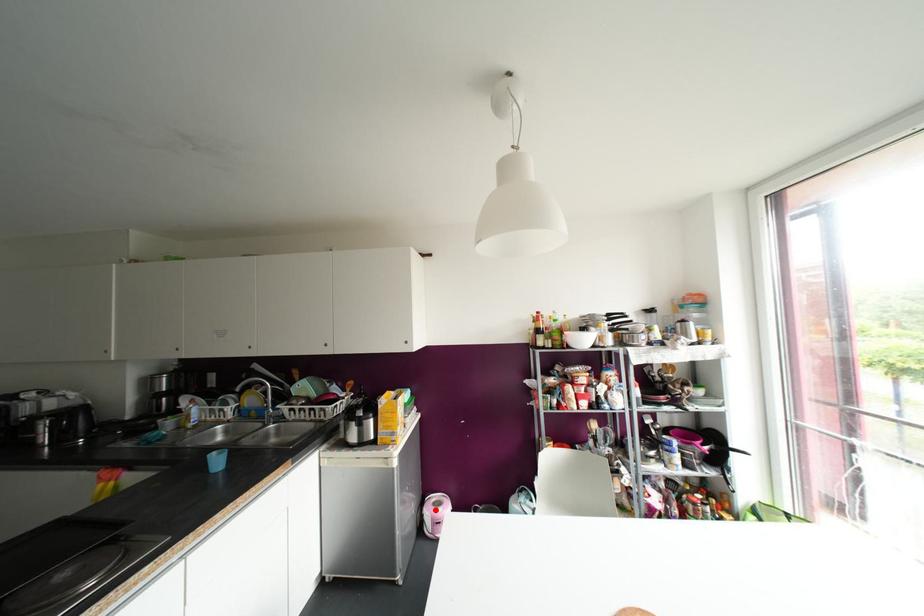
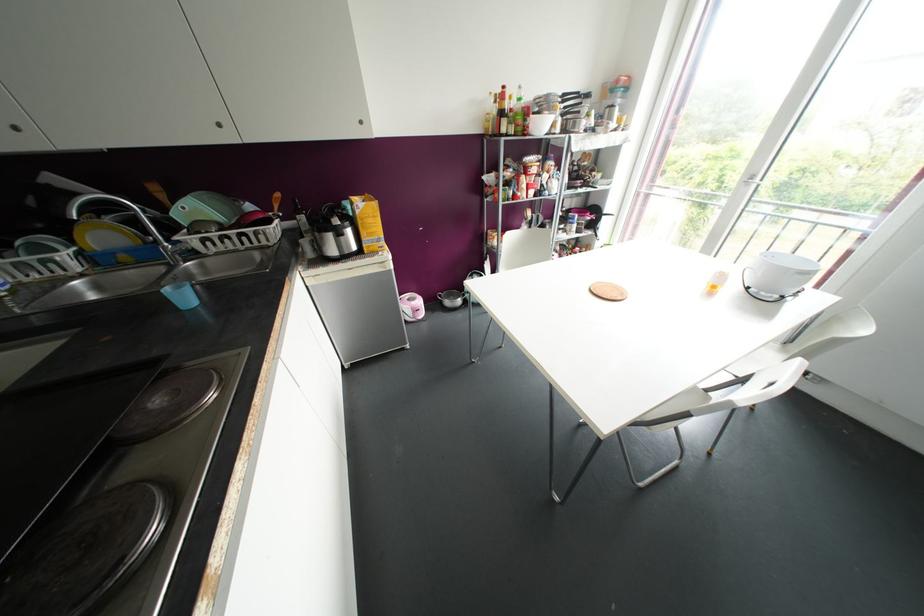
Question: I am providing you with two images of the same scene from different viewpoints. Image1 has a red point marked. In image2, the corresponding 3D location appears at what relative position? Reply with the corresponding letter.

Choices:
 (A) Closer
 (B) Farther

Answer: (A)